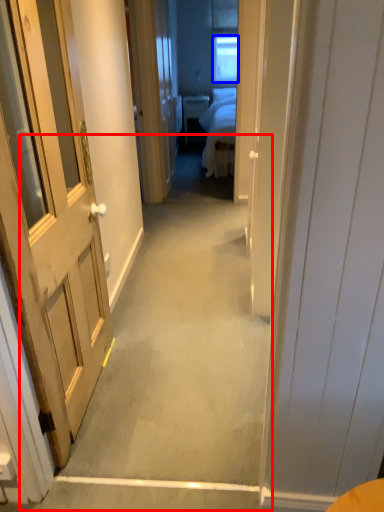
Question: Which of the following is the closest to the observer, path (highlighted by a red box) or window (highlighted by a blue box)?

Choices:
 (A) path
 (B) window

Answer: (A)